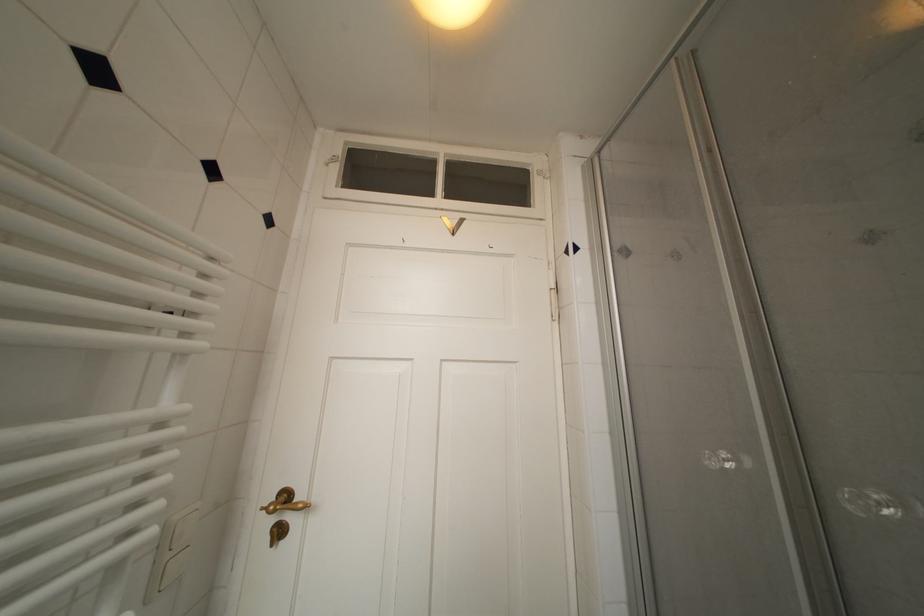
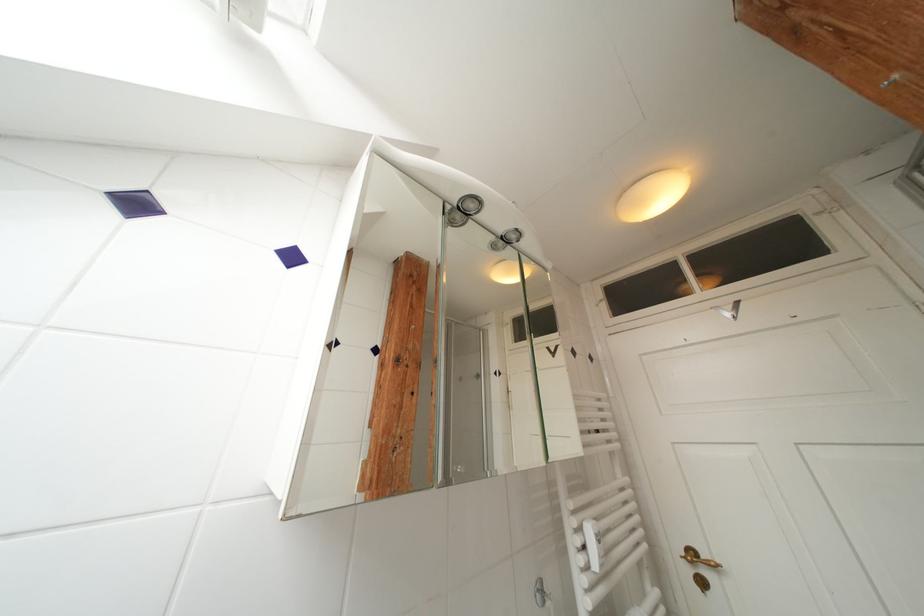
The point at [293,500] is marked in the first image. Where is the corresponding point in the second image?

(699, 557)